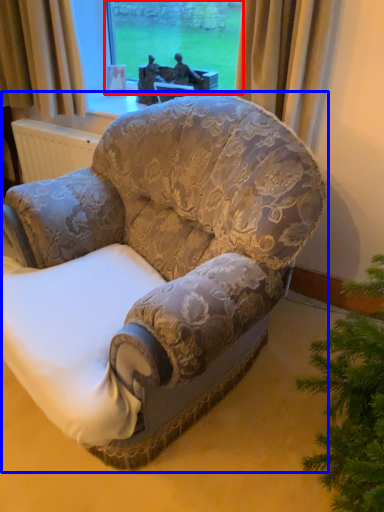
Question: Among these objects, which one is nearest to the camera, window screen (highlighted by a red box) or chair (highlighted by a blue box)?

Choices:
 (A) window screen
 (B) chair

Answer: (B)